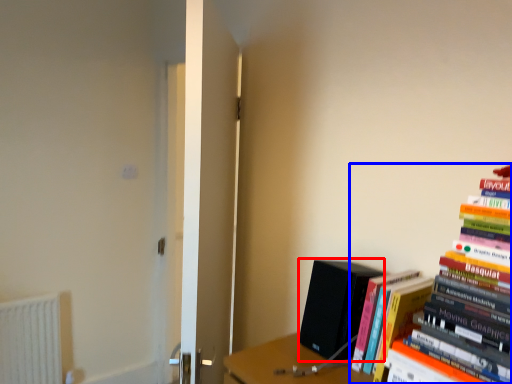
Question: Which point is closer to the camera, paperback book (highlighted by a red box) or book (highlighted by a blue box)?

Choices:
 (A) paperback book
 (B) book

Answer: (B)